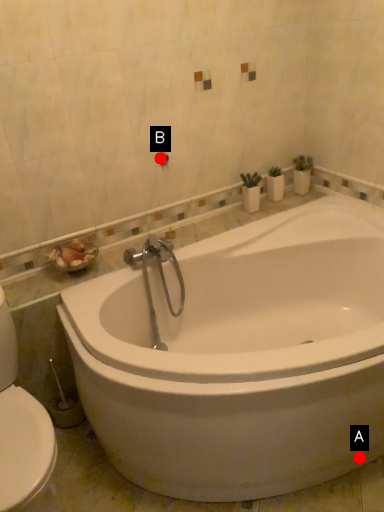
Question: Two points are circled on the image, labeled by A and B beside each circle. Which point appears closest to the camera in this image?

Choices:
 (A) A is closer
 (B) B is closer

Answer: (A)